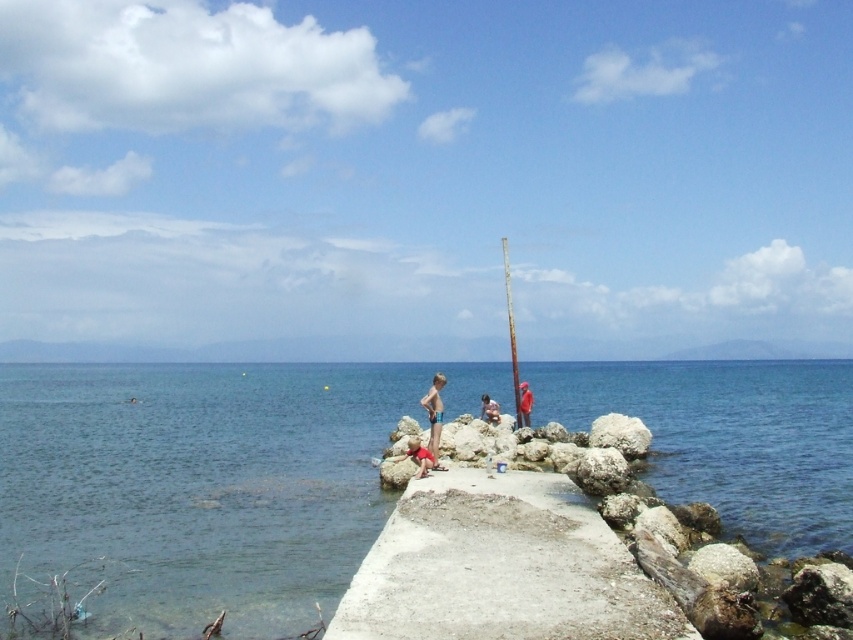
Consider the image. Can you confirm if clear blue water at center is bigger than blue swim trunks at center?

Yes, clear blue water at center is bigger than blue swim trunks at center.

Is point (770, 472) positioned after point (434, 419)?

Yes, it is.

The height and width of the screenshot is (640, 853). I want to click on clear blue water at center, so click(206, 483).

Measure the distance between blue swim trunks at center and smooth skin person at center.

They are 22.59 feet apart.

Is point (430, 416) farther from viewer compared to point (482, 416)?

No, it is not.

The image size is (853, 640). I want to click on blue swim trunks at center, so click(434, 416).

Is rusty metal pole at center to the left of smooth skin person at center from the viewer's perspective?

In fact, rusty metal pole at center is to the right of smooth skin person at center.

Is rusty metal pole at center to the right of smooth skin person at center from the viewer's perspective?

Indeed, rusty metal pole at center is positioned on the right side of smooth skin person at center.

The width and height of the screenshot is (853, 640). Find the location of `rusty metal pole at center`. rusty metal pole at center is located at coordinates (511, 332).